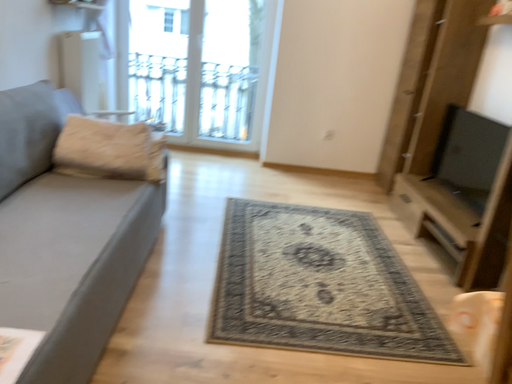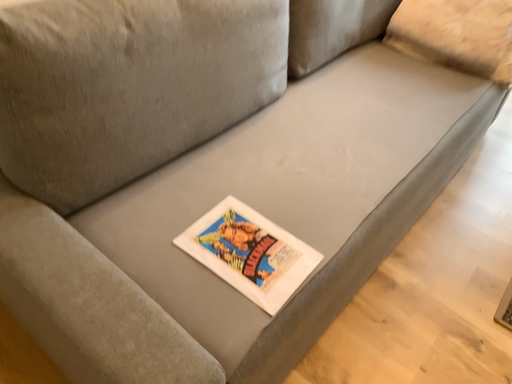
Question: Which way did the camera rotate in the video?

Choices:
 (A) rotated left
 (B) rotated right

Answer: (A)